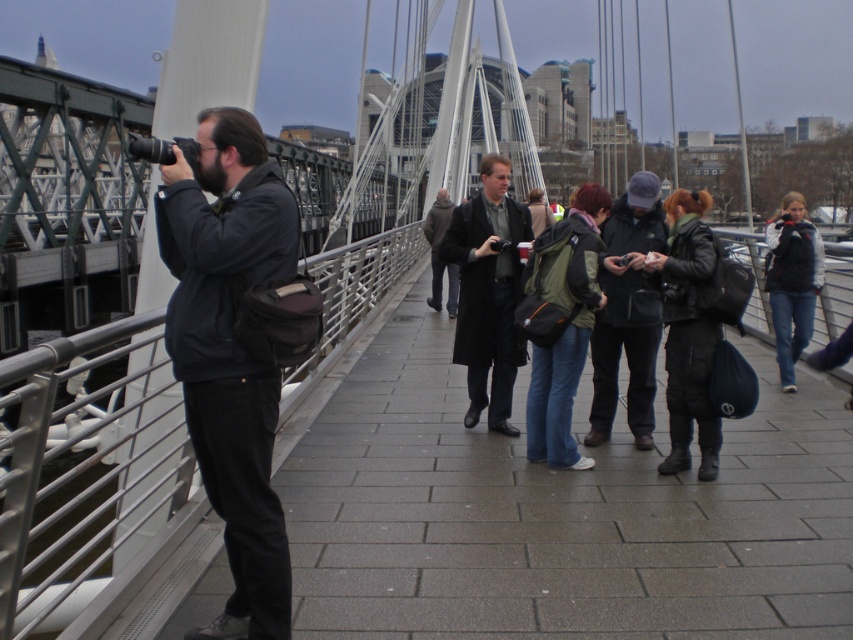
You are a photographer on the bridge and need to position yourself so that both the dark gray knit cap at center and the dark brown wool coat at center are visible in your shot. Based on their positions, which object should you prioritize keeping closer to the edge of the frame to ensure both are fully captured?

The dark gray knit cap at center might be wider than the dark brown wool coat at center, so you should prioritize keeping the dark gray knit cap at center closer to the edge of the frame to ensure both are fully captured.